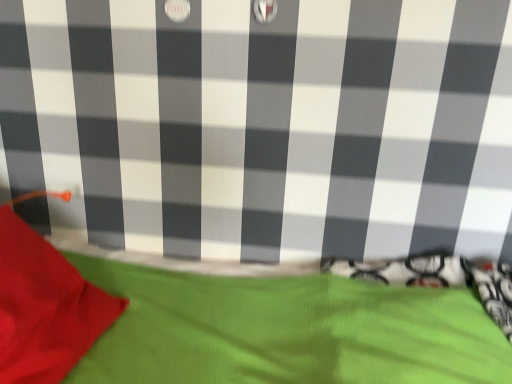
Measure the distance between point (91,291) and camera.

A distance of 1.10 meters exists between point (91,291) and camera.

The image size is (512, 384). What do you see at coordinates (45, 307) in the screenshot?
I see `matte red fabric at left` at bounding box center [45, 307].

The height and width of the screenshot is (384, 512). In order to click on matte red fabric at left in this screenshot , I will do `click(45, 307)`.

This screenshot has height=384, width=512. I want to click on matte red fabric at left, so click(45, 307).